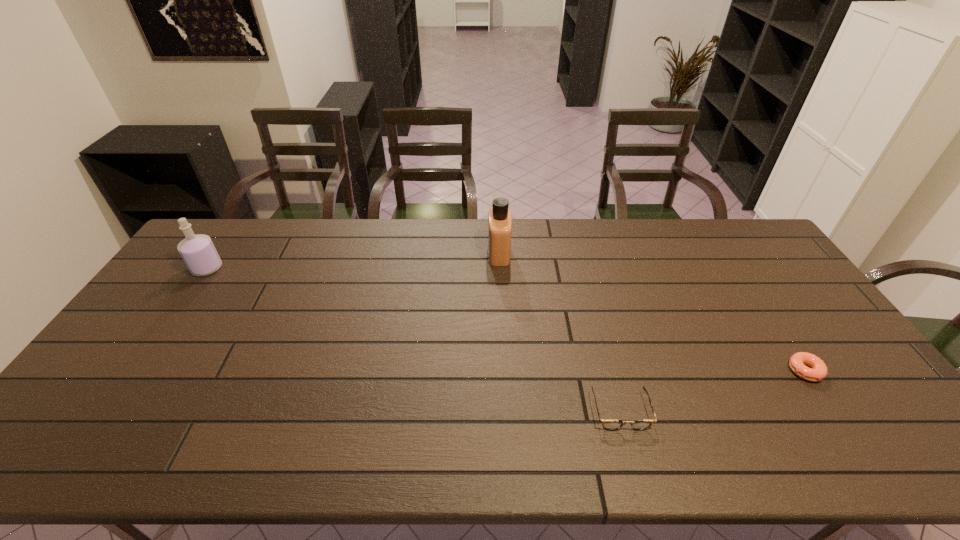
This screenshot has height=540, width=960. I want to click on free region located 0.130m on the back of the third farthest object, so click(x=773, y=322).

Find the location of a particular element. This screenshot has width=960, height=540. object located at the near edge is located at coordinates (611, 425).

The width and height of the screenshot is (960, 540). What are the coordinates of `object at the left edge` in the screenshot? It's located at (198, 251).

The image size is (960, 540). What are the coordinates of `object that is at the right edge` in the screenshot? It's located at (818, 371).

Locate an element on the screen. The image size is (960, 540). object present at the far left corner is located at coordinates (198, 251).

At what (x,y) coordinates should I click in order to perform the action: click on free space at the far edge of the desktop. Please return your answer as a coordinate pair (x, y). The image size is (960, 540). Looking at the image, I should click on (528, 240).

In the image, there is a desktop. Identify the location of vacant space at the near edge. coord(528,436).

At what (x,y) coordinates should I click in order to perform the action: click on vacant region at the left edge of the desktop. Please return your answer as a coordinate pair (x, y). Looking at the image, I should click on (217, 272).

You are a GUI agent. You are given a task and a screenshot of the screen. Output one action in this format:
    pyautogui.click(x=<x>, y=<y>)
    Task: Click on the blank space at the right edge of the desktop
    
    Given the screenshot: What is the action you would take?
    pyautogui.click(x=825, y=357)

Image resolution: width=960 pixels, height=540 pixels. In the image, there is a desktop. In order to click on vacant space at the far right corner in this screenshot , I will do `click(712, 224)`.